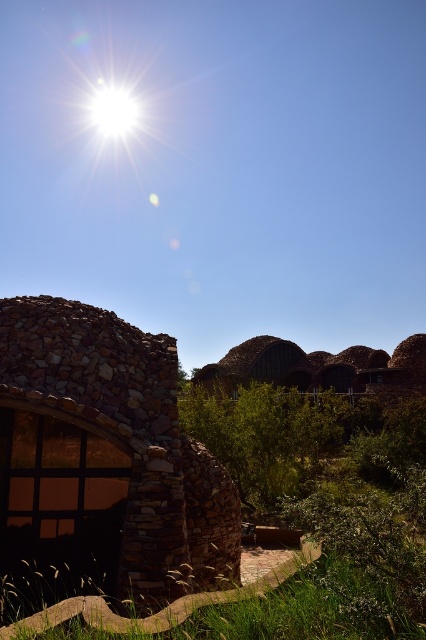
Does rustic stone hut at center have a greater height compared to green grass at lower center?

Incorrect, rustic stone hut at center's height is not larger of green grass at lower center's.

Who is taller, rustic stone hut at center or green grass at lower center?

green grass at lower center is taller.

This screenshot has width=426, height=640. What are the coordinates of `rustic stone hut at center` in the screenshot? It's located at (319, 368).

Who is more forward, (60, 502) or (294, 572)?

Point (294, 572) is in front.

Find the location of a particular element. Image resolution: width=426 pixels, height=640 pixels. rustic stone hut at left is located at coordinates (106, 454).

Who is more forward, (55, 493) or (411, 369)?

Point (55, 493) is more forward.

Who is higher up, rustic stone hut at left or rustic stone hut at center?

rustic stone hut at left

At what (x,y) coordinates should I click in order to perform the action: click on rustic stone hut at left. Please return your answer as a coordinate pair (x, y). The image size is (426, 640). Looking at the image, I should click on (106, 454).

Where is `rustic stone hut at left`? rustic stone hut at left is located at coordinates (106, 454).